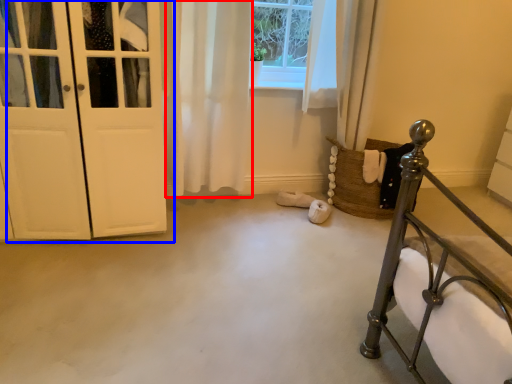
Question: Among these objects, which one is nearest to the camera, curtain (highlighted by a red box) or door (highlighted by a blue box)?

Choices:
 (A) curtain
 (B) door

Answer: (B)